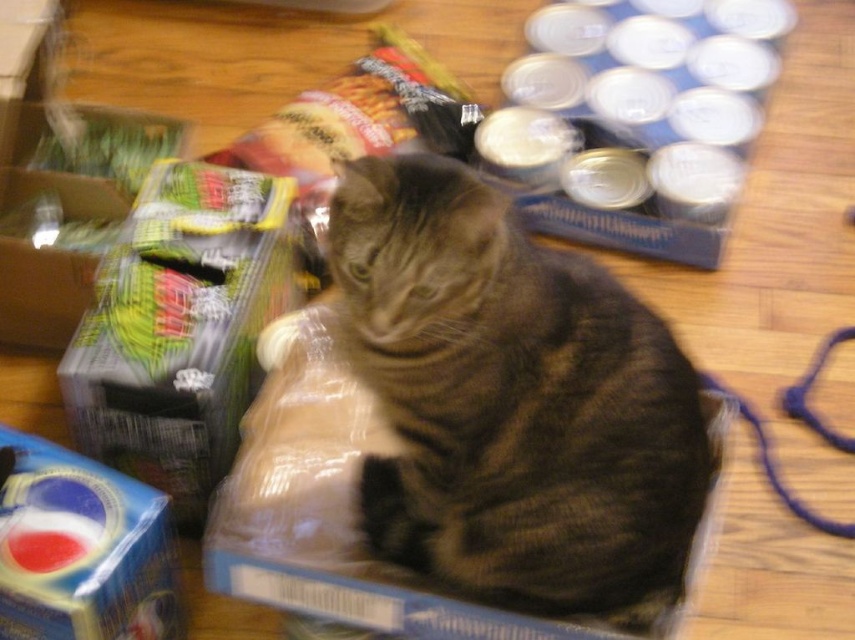
Is point (547, 307) closer to viewer compared to point (75, 388)?

Yes, point (547, 307) is closer to viewer.

Does gray tabby cat at center have a smaller size compared to translucent plastic bag at center?

Incorrect, gray tabby cat at center is not smaller in size than translucent plastic bag at center.

Is point (558, 289) more distant than point (223, 349)?

No, it is not.

Where is `gray tabby cat at center`? The width and height of the screenshot is (855, 640). gray tabby cat at center is located at coordinates (513, 401).

Which is above, gray tabby cat at center or blue cardboard box at lower left?

gray tabby cat at center is higher up.

What do you see at coordinates (513, 401) in the screenshot? This screenshot has height=640, width=855. I see `gray tabby cat at center` at bounding box center [513, 401].

Who is more distant from viewer, (382,269) or (116,524)?

Positioned behind is point (116,524).

Identify the location of gray tabby cat at center. This screenshot has width=855, height=640. (513, 401).

Which is below, translucent plastic bag at center or blue cardboard box at lower left?

blue cardboard box at lower left

Is translucent plastic bag at center positioned behind blue cardboard box at lower left?

Yes, translucent plastic bag at center is further from the viewer.

Does point (119, 444) lie behind point (96, 488)?

Yes, it is behind point (96, 488).

Locate an element on the screen. The image size is (855, 640). translucent plastic bag at center is located at coordinates (180, 326).